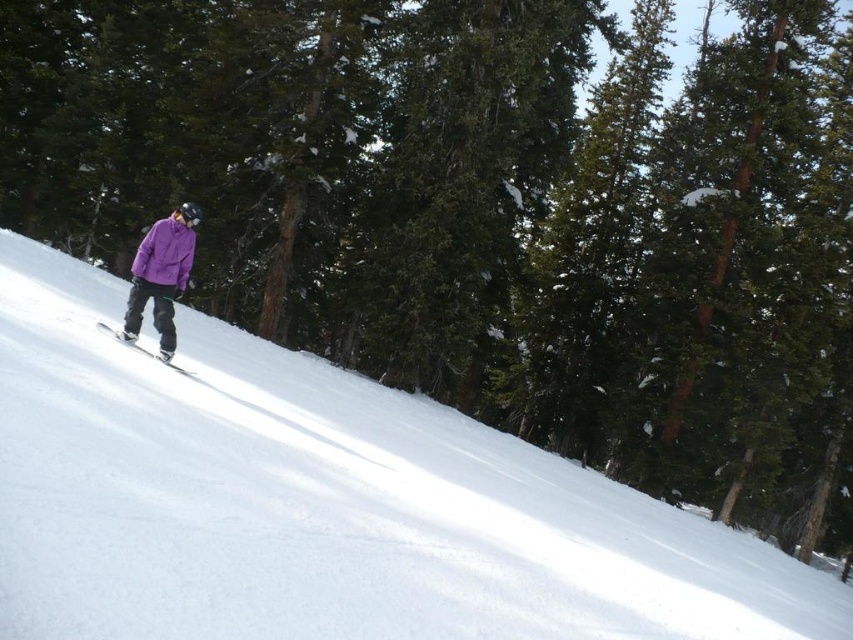
Which is in front, point (399, 472) or point (181, 275)?

Point (399, 472) is in front.

In the scene shown: Can you confirm if white snow at center is taller than purple fleece jacket at center?

Yes.

Locate an element on the screen. The height and width of the screenshot is (640, 853). white snow at center is located at coordinates pos(322,502).

I want to click on white snow at center, so click(322, 502).

Between point (230, 429) and point (97, 324), which one is positioned in front?

Point (230, 429) is more forward.

Does white snow at center appear on the left side of white metallic ski at center?

In fact, white snow at center is to the right of white metallic ski at center.

Is point (517, 444) closer to viewer compared to point (131, 348)?

No.

The height and width of the screenshot is (640, 853). What are the coordinates of `white snow at center` in the screenshot? It's located at (322, 502).

Which of these two, purple matte jacket at left or white metallic ski at center, stands taller?

purple matte jacket at left

Does purple matte jacket at left appear on the left side of white metallic ski at center?

No, purple matte jacket at left is not to the left of white metallic ski at center.

Between point (190, 211) and point (135, 346), which one is positioned behind?

Positioned behind is point (135, 346).

Find the location of a particular element. purple matte jacket at left is located at coordinates (161, 275).